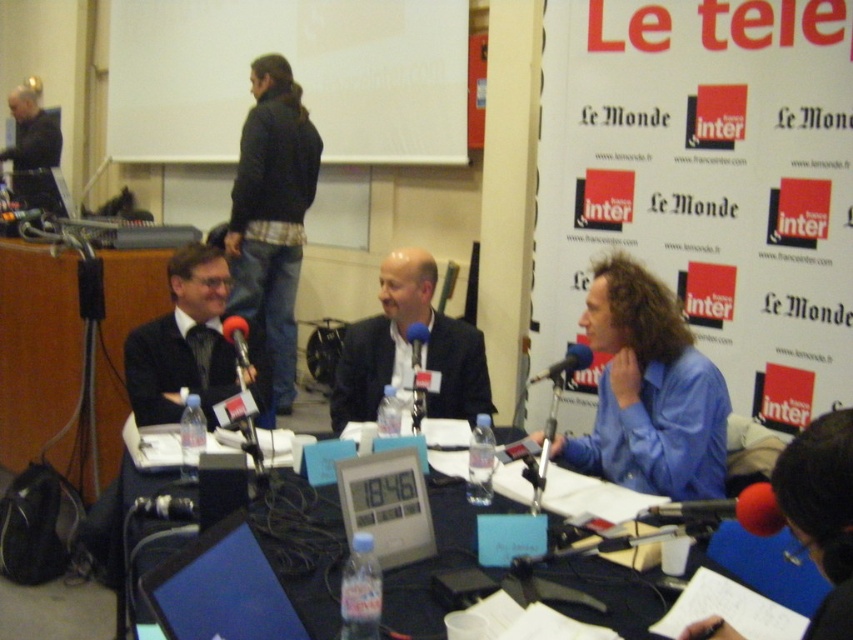
Is point (303, 124) farther from camera compared to point (151, 508)?

Yes, it is.

Between point (305, 172) and point (192, 509), which one is positioned in front?

Positioned in front is point (192, 509).

Where is `black cotton jacket at upper center`? The width and height of the screenshot is (853, 640). black cotton jacket at upper center is located at coordinates (271, 212).

Is shiny black laptop at center taller than dark gray suit at upper left?

In fact, shiny black laptop at center may be shorter than dark gray suit at upper left.

Consider the image. Can you confirm if shiny black laptop at center is positioned to the right of dark gray suit at upper left?

Indeed, shiny black laptop at center is positioned on the right side of dark gray suit at upper left.

Is point (212, 534) positioned before point (16, 129)?

Yes, point (212, 534) is closer to viewer.

At what (x,y) coordinates should I click in order to perform the action: click on shiny black laptop at center. Please return your answer as a coordinate pair (x, y). The image size is (853, 640). Looking at the image, I should click on pos(221,589).

Is blue fabric at lower right positioned at the back of black matte microphone at right?

No, blue fabric at lower right is closer to the viewer.

Consider the image. Can you confirm if blue fabric at lower right is bigger than black matte microphone at right?

Correct, blue fabric at lower right is larger in size than black matte microphone at right.

This screenshot has height=640, width=853. What do you see at coordinates (822, 513) in the screenshot?
I see `blue fabric at lower right` at bounding box center [822, 513].

The width and height of the screenshot is (853, 640). Find the location of `blue fabric at lower right`. blue fabric at lower right is located at coordinates (822, 513).